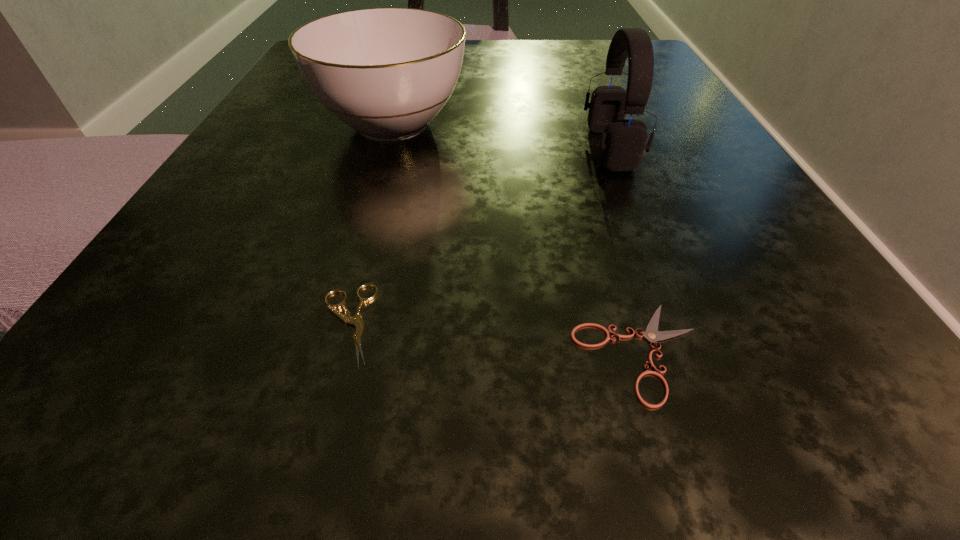
Locate an element on the screen. free space between the chinaware and the third tallest object is located at coordinates (370, 224).

Locate an element on the screen. free space between the right shears and the chinaware is located at coordinates (516, 238).

In order to click on empty space between the tallest object and the taller shears in this screenshot , I will do `click(478, 235)`.

Find the location of a particular element. The image size is (960, 540). free spot between the chinaware and the left shears is located at coordinates (370, 224).

The image size is (960, 540). I want to click on vacant point located between the third shortest object and the headset, so click(x=501, y=136).

At what (x,y) coordinates should I click in order to perform the action: click on the second closest object to the shorter shears. Please return your answer as a coordinate pair (x, y). The width and height of the screenshot is (960, 540). Looking at the image, I should click on (623, 142).

In order to click on object that can be found as the second closest to the second tallest object in this screenshot , I will do [357, 321].

Image resolution: width=960 pixels, height=540 pixels. What are the coordinates of `vacant region that satisfies the following two spatial constraints: 1. on the front side of the right shears; 2. on the right side of the chinaware` in the screenshot? It's located at (326, 353).